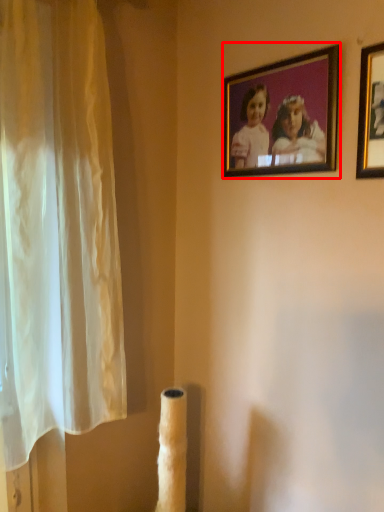
Question: From the image's perspective, what is the correct spatial relationship of picture frame (annotated by the red box) in relation to picture frame?

Choices:
 (A) below
 (B) above

Answer: (B)